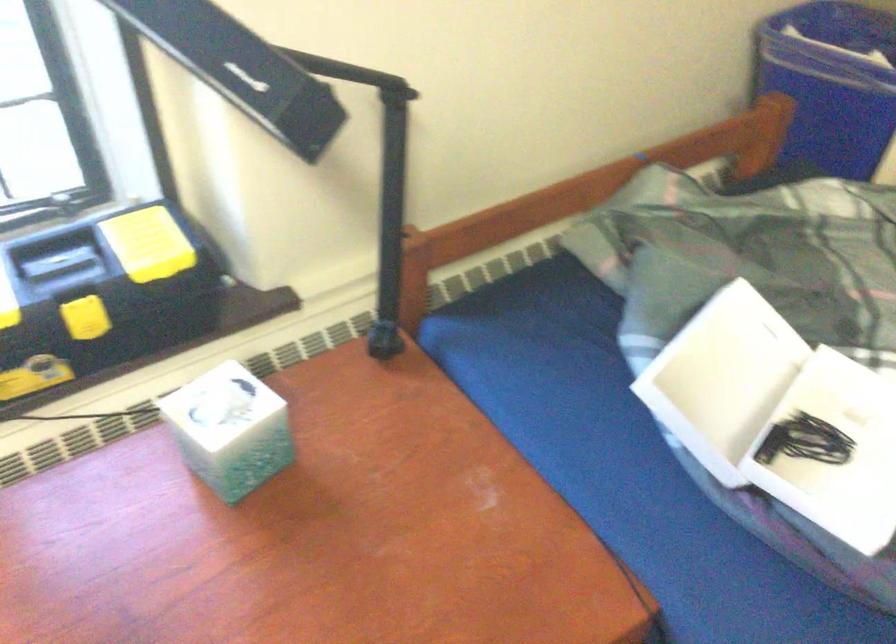
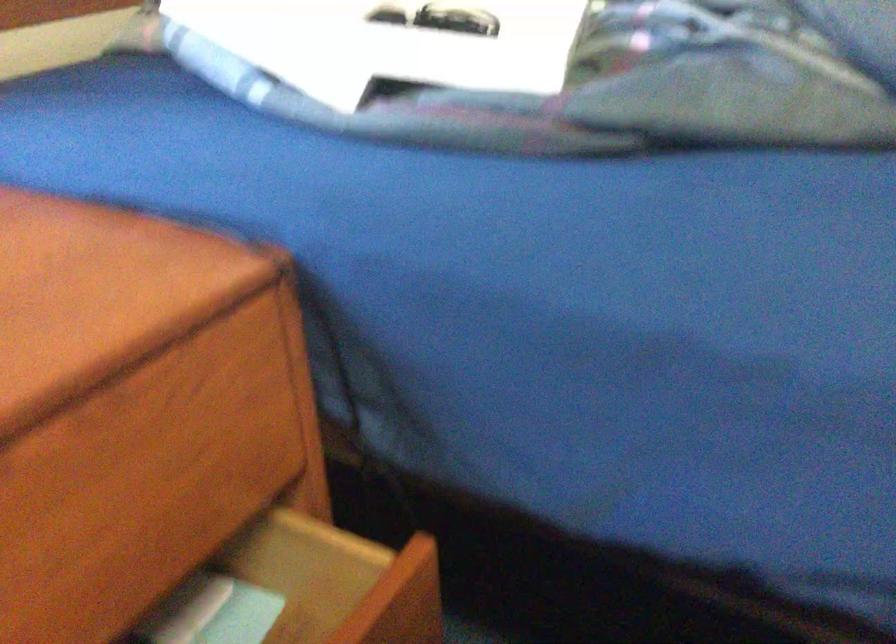
The images are taken continuously from a first-person perspective. In which direction are you moving?

The cameraman moved toward right, forward.